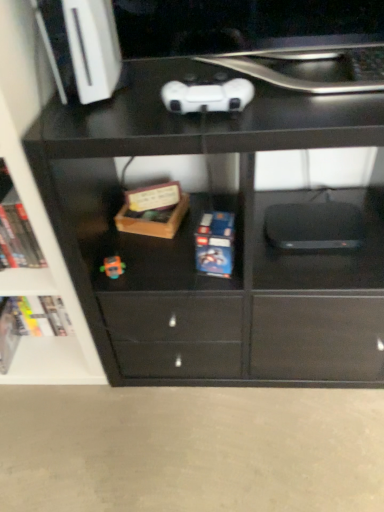
Question: From a real-world perspective, is wooden box at center physically located above or below black matte laptop keyboard at upper center?

Choices:
 (A) below
 (B) above

Answer: (A)

Question: Looking at the image, does wooden box at center seem bigger or smaller compared to black matte laptop keyboard at upper center?

Choices:
 (A) big
 (B) small

Answer: (A)

Question: Which is farther from the black matte shelf at upper left?

Choices:
 (A) hardcover book at lower left, positioned as the 1th book in bottom-to-top order
 (B) wooden box at center
 (C) hardcover book at left, which is the second book from bottom to top
 (D) white matte game controller at upper center
 (E) blue matte lego box at center, which is the 2th paperback book from back to front

Answer: (D)

Question: Which of these objects is positioned closest to the wooden box at center?

Choices:
 (A) blue matte lego box at center, which is the 2th paperback book from back to front
 (B) hardcover book at left, which is the 1th book from top to bottom
 (C) hardcover book at left, the 2th paperback book viewed from the top
 (D) black matte chest of drawers at center
 (E) hardcover book at lower left, which is the first book from back to front

Answer: (A)